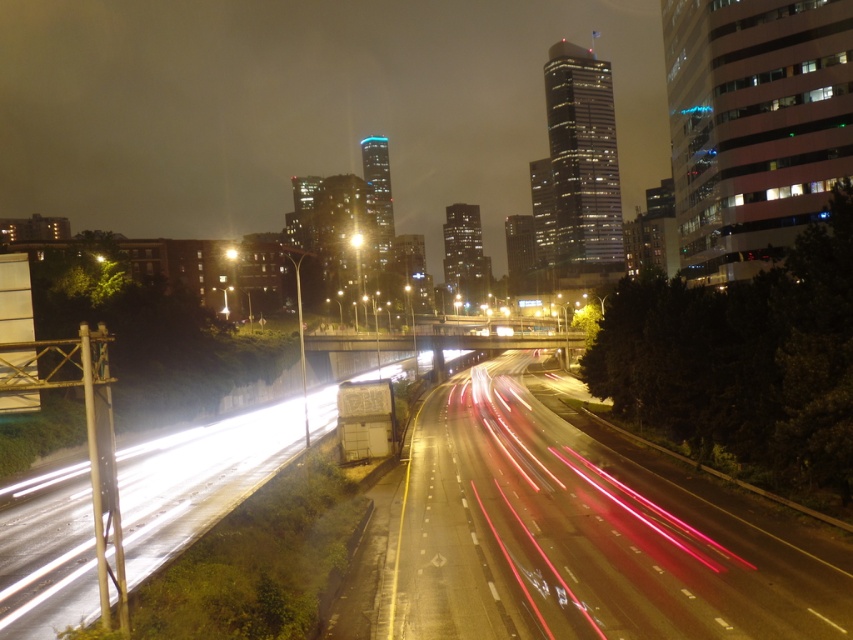
Question: Which of the following is the farthest from the observer?

Choices:
 (A) metallic asphalt highway at center
 (B) bright yellow light at center

Answer: (B)

Question: Is metallic asphalt highway at center closer to camera compared to bright yellow light at center?

Choices:
 (A) yes
 (B) no

Answer: (A)

Question: Which point is closer to the camera?

Choices:
 (A) (357, 232)
 (B) (381, 506)

Answer: (B)

Question: Is metallic asphalt highway at center below bright yellow light at center?

Choices:
 (A) yes
 (B) no

Answer: (A)

Question: Can you confirm if metallic asphalt highway at center is positioned to the left of bright yellow light at center?

Choices:
 (A) yes
 (B) no

Answer: (B)